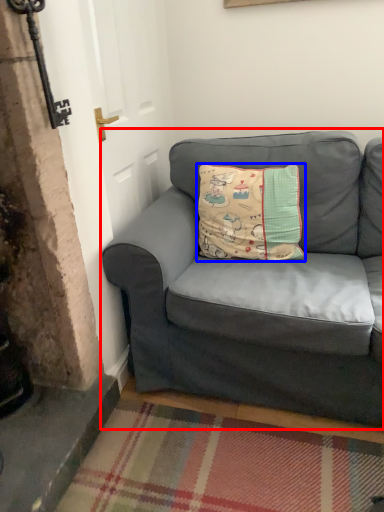
Question: Which point is further to the camera, studio couch (highlighted by a red box) or pillow (highlighted by a blue box)?

Choices:
 (A) studio couch
 (B) pillow

Answer: (B)